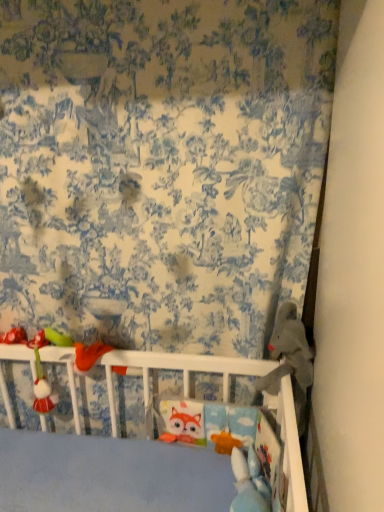
Question: Is blue printed fabric at upper center taller than matte plastic rattle at left, which appears as the first toy when viewed from the left?

Choices:
 (A) no
 (B) yes

Answer: (B)

Question: Is blue printed fabric at upper center looking in the opposite direction of matte plastic rattle at left, which appears as the second toy when viewed from the right?

Choices:
 (A) no
 (B) yes

Answer: (B)

Question: Is blue printed fabric at upper center to the right of matte plastic rattle at left, which appears as the second toy when viewed from the right, from the viewer's perspective?

Choices:
 (A) yes
 (B) no

Answer: (A)

Question: From the image's perspective, is blue printed fabric at upper center below matte plastic rattle at left, which appears as the first toy when viewed from the left?

Choices:
 (A) no
 (B) yes

Answer: (A)

Question: Does blue printed fabric at upper center turn towards matte plastic rattle at left, which appears as the second toy when viewed from the right?

Choices:
 (A) yes
 (B) no

Answer: (A)

Question: Is blue printed fabric at upper center spatially inside gray plush bear at right, which is the 1th toy in right-to-left order, or outside of it?

Choices:
 (A) outside
 (B) inside

Answer: (A)

Question: From a real-world perspective, relative to gray plush bear at right, arranged as the second toy when viewed from the left, is blue printed fabric at upper center vertically above or below?

Choices:
 (A) below
 (B) above

Answer: (B)

Question: In the image, is blue printed fabric at upper center positioned in front of or behind gray plush bear at right, which is the 1th toy in right-to-left order?

Choices:
 (A) front
 (B) behind

Answer: (A)

Question: Considering the positions of blue printed fabric at upper center and gray plush bear at right, arranged as the second toy when viewed from the left, in the image, is blue printed fabric at upper center bigger or smaller than gray plush bear at right, arranged as the second toy when viewed from the left,?

Choices:
 (A) small
 (B) big

Answer: (B)

Question: Is gray plush bear at right, which is the 1th toy in right-to-left order, in front of or behind blue printed fabric at upper center in the image?

Choices:
 (A) behind
 (B) front

Answer: (A)

Question: From the image's perspective, relative to blue printed fabric at upper center, is gray plush bear at right, arranged as the second toy when viewed from the left, above or below?

Choices:
 (A) above
 (B) below

Answer: (B)

Question: Is gray plush bear at right, which is the 1th toy in right-to-left order, bigger or smaller than blue printed fabric at upper center?

Choices:
 (A) small
 (B) big

Answer: (A)

Question: Is point (301, 403) closer or farther from the camera than point (251, 312)?

Choices:
 (A) farther
 (B) closer

Answer: (A)

Question: Is gray plush bear at right, which is the 1th toy in right-to-left order, bigger or smaller than matte plastic rattle at left, which appears as the first toy when viewed from the left?

Choices:
 (A) small
 (B) big

Answer: (B)

Question: In terms of height, does gray plush bear at right, arranged as the second toy when viewed from the left, look taller or shorter compared to matte plastic rattle at left, which appears as the first toy when viewed from the left?

Choices:
 (A) tall
 (B) short

Answer: (B)